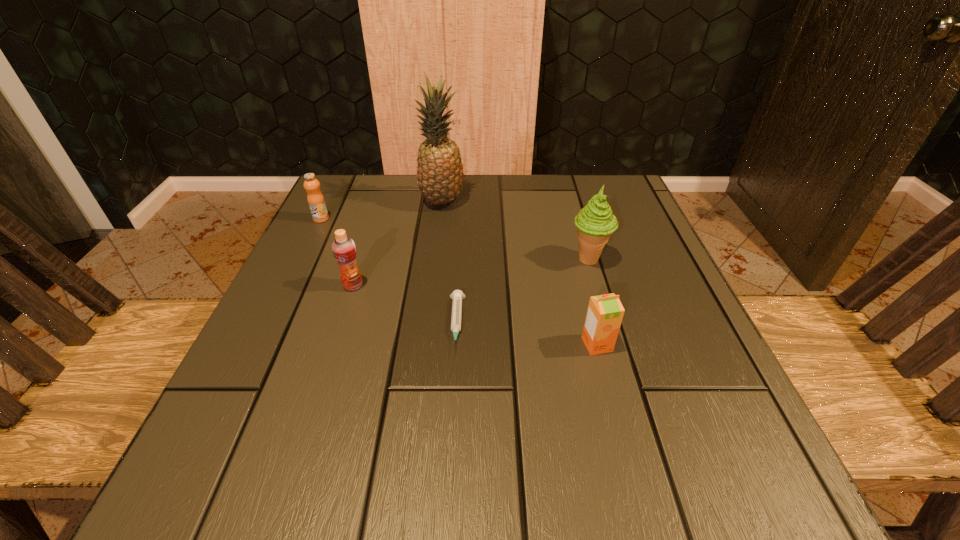
Identify the location of vacant area that lies between the third nearest object and the syringe. The height and width of the screenshot is (540, 960). (405, 305).

Locate an element on the screen. The height and width of the screenshot is (540, 960). free spot between the icecream and the leftmost object is located at coordinates (455, 239).

Find the location of a particular element. This screenshot has width=960, height=540. vacant region between the leftmost object and the icecream is located at coordinates (455, 239).

You are a GUI agent. You are given a task and a screenshot of the screen. Output one action in this format:
    pyautogui.click(x=<x>, y=<y>)
    Task: Click on the unoccupied area between the rightmost orange juice and the tallest object
    The width and height of the screenshot is (960, 540).
    Given the screenshot: What is the action you would take?
    pyautogui.click(x=519, y=273)

Where is `free space between the syringe and the rightmost orange juice`? The width and height of the screenshot is (960, 540). free space between the syringe and the rightmost orange juice is located at coordinates (527, 334).

Where is `the second closest object relative to the shortest object`? The image size is (960, 540). the second closest object relative to the shortest object is located at coordinates (605, 312).

The height and width of the screenshot is (540, 960). Find the location of `object that is the nearest to the leftmost object`. object that is the nearest to the leftmost object is located at coordinates (440, 174).

Select which orange juice appears as the closest to the pineapple. Please provide its 2D coordinates. Your answer should be formatted as a tuple, i.e. [(x, y)], where the tuple contains the x and y coordinates of a point satisfying the conditions above.

[(315, 199)]

Where is `orange juice that can be found as the second closest to the nearest orange juice`? orange juice that can be found as the second closest to the nearest orange juice is located at coordinates (315, 199).

Identify the location of vacant area that satisfies the following two spatial constraints: 1. at the needle end of the syringe; 2. on the right side of the rightmost orange juice. This screenshot has width=960, height=540. (455, 345).